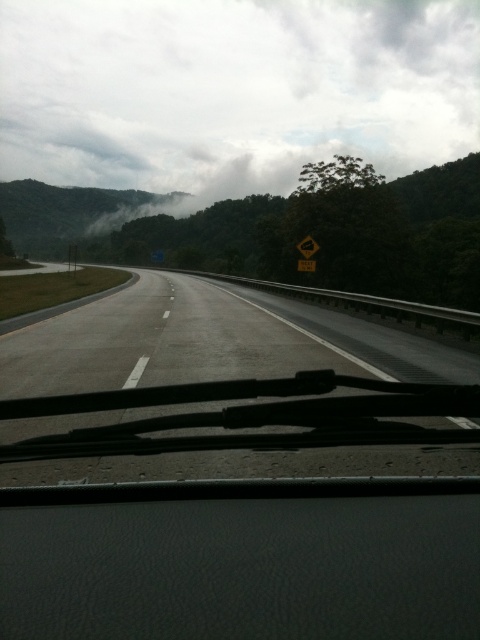
You are a passenger in the car and looking out the windshield. There are two points marked on the road ahead. The first point is at coordinates point (400,170) and the second is at point (199,371). Which point is closer to the car?

Point (199,371) is closer to the car because it is less far from the camera than point (400,170).